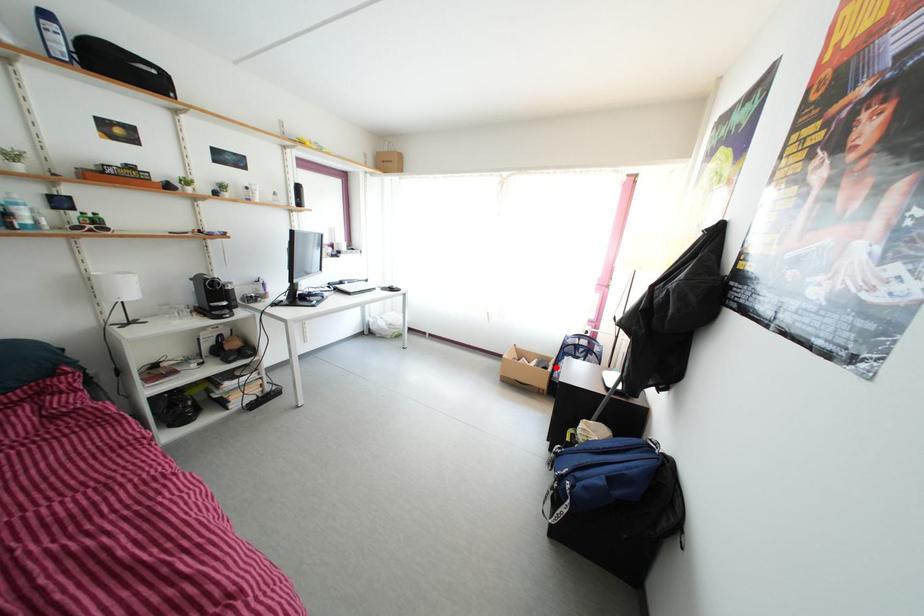
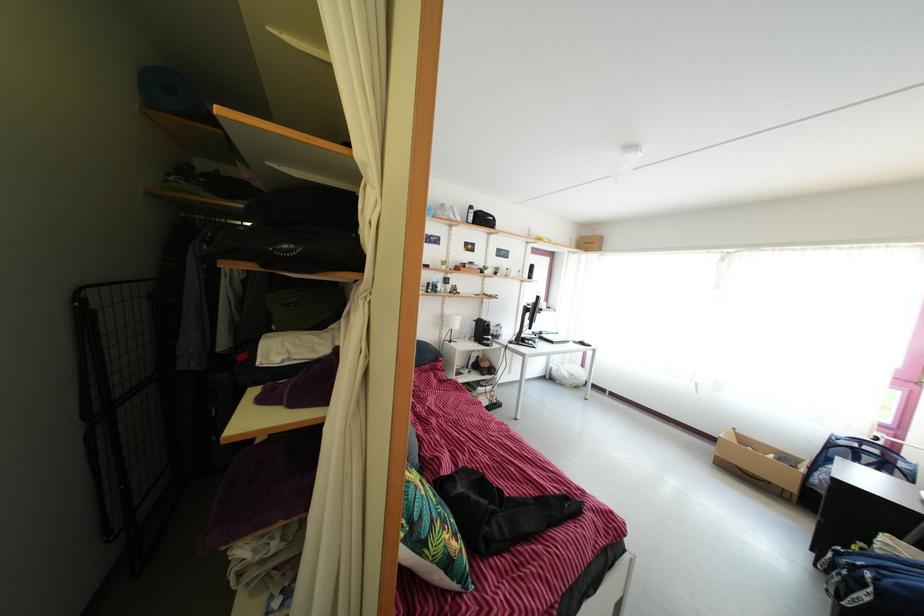
Find the pixel in the second image that matches the highlighted location in the first image.

(805, 468)